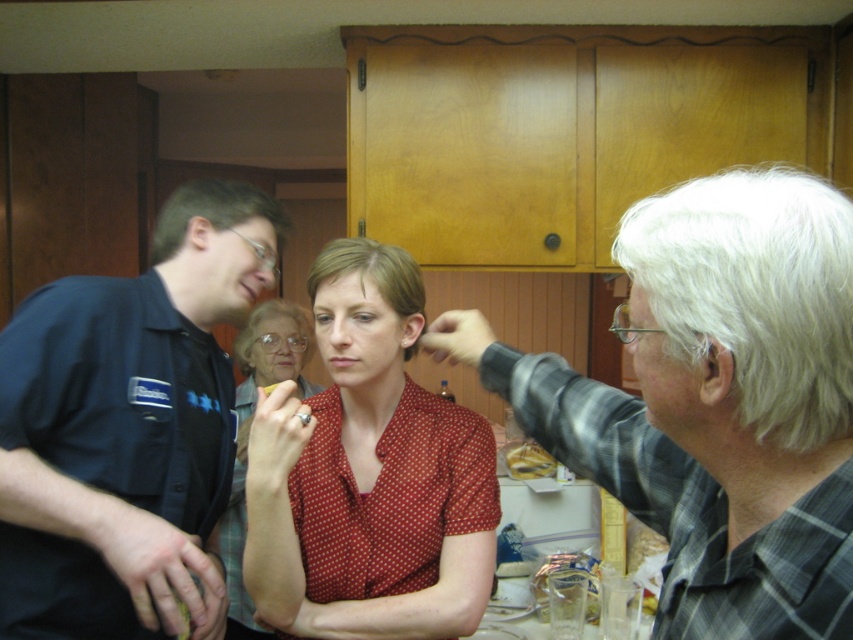
Question: Is dark blue shirt at left further to the viewer compared to golden brown bread at center?

Choices:
 (A) no
 (B) yes

Answer: (A)

Question: Which object is farther from the camera taking this photo?

Choices:
 (A) golden brown bread at center
 (B) dark blue shirt at left

Answer: (A)

Question: Which is nearer to the gray plaid shirt at upper right?

Choices:
 (A) dark blue shirt at left
 (B) golden brown bread at center
 (C) red dotted shirt at center

Answer: (C)

Question: Can you confirm if red dotted shirt at center is positioned above golden brown bread at center?

Choices:
 (A) no
 (B) yes

Answer: (B)

Question: Can you confirm if red dotted shirt at center is wider than red dotted blouse at center?

Choices:
 (A) yes
 (B) no

Answer: (A)

Question: Which object is farther from the camera taking this photo?

Choices:
 (A) golden brown bread at center
 (B) dark blue shirt at left
 (C) red dotted blouse at center
 (D) gray plaid shirt at upper right

Answer: (A)